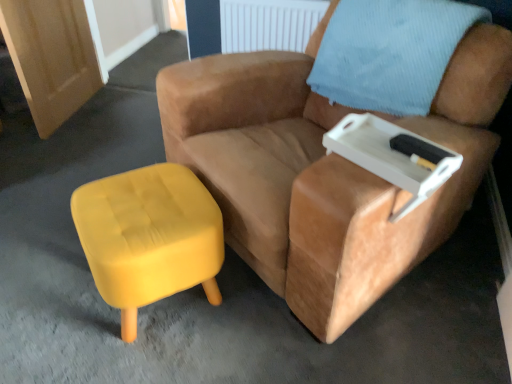
What is the approximate height of yellow fabric stool at lower left?

It is 16.01 inches.

You are a GUI agent. You are given a task and a screenshot of the screen. Output one action in this format:
    pyautogui.click(x=<x>, y=<y>)
    Task: Click on the light blue textured pillow at upper right
    Image resolution: width=512 pixels, height=384 pixels.
    Given the screenshot: What is the action you would take?
    pyautogui.click(x=390, y=52)

This screenshot has width=512, height=384. What are the coordinates of `yellow fabric stool at lower left` in the screenshot? It's located at (149, 237).

Between suede tan armchair at center and white plastic tray at upper right, which one has larger size?

suede tan armchair at center.

Is suede tan armchair at center to the right of white plastic tray at upper right from the viewer's perspective?

No.

In the scene shown: Are suede tan armchair at center and white plastic tray at upper right located far from each other?

Actually, suede tan armchair at center and white plastic tray at upper right are a little close together.

Considering the positions of points (276, 211) and (432, 163), is point (276, 211) farther from camera compared to point (432, 163)?

Yes, point (276, 211) is farther from viewer.

Is suede tan armchair at center closer to camera compared to light blue textured pillow at upper right?

Yes.

Is the surface of suede tan armchair at center in direct contact with light blue textured pillow at upper right?

suede tan armchair at center and light blue textured pillow at upper right are clearly separated.

Where is `pillow located above the suede tan armchair at center (from a real-world perspective)`? pillow located above the suede tan armchair at center (from a real-world perspective) is located at coordinates (390, 52).

Is suede tan armchair at center bigger or smaller than light blue textured pillow at upper right?

suede tan armchair at center is bigger than light blue textured pillow at upper right.

How many degrees apart are the facing directions of white plastic tray at upper right and suede tan armchair at center?

There is a 3.54-degree angle between the facing directions of white plastic tray at upper right and suede tan armchair at center.

Based on the photo, is white plastic tray at upper right taller or shorter than suede tan armchair at center?

Clearly, white plastic tray at upper right is shorter compared to suede tan armchair at center.

Is white plastic tray at upper right behind suede tan armchair at center?

Yes, white plastic tray at upper right is further from the viewer.

Is white plastic tray at upper right not close to suede tan armchair at center?

No, white plastic tray at upper right is in close proximity to suede tan armchair at center.

Find the location of a particular element. The width and height of the screenshot is (512, 384). stool beneath the white plastic tray at upper right (from a real-world perspective) is located at coordinates (149, 237).

Considering the relative sizes of yellow fabric stool at lower left and white plastic tray at upper right in the image provided, is yellow fabric stool at lower left taller than white plastic tray at upper right?

Indeed, yellow fabric stool at lower left has a greater height compared to white plastic tray at upper right.

Which is nearer, (x=398, y=34) or (x=310, y=72)?

Point (x=398, y=34).

From the image's perspective, is light blue textured pillow at upper right located above or below suede tan armchair at center?

Clearly, from the image's perspective, light blue textured pillow at upper right is above suede tan armchair at center.

Do you think light blue textured pillow at upper right is within suede tan armchair at center, or outside of it?

The correct answer is: inside.

Can you confirm if light blue textured pillow at upper right is thinner than yellow fabric stool at lower left?

In fact, light blue textured pillow at upper right might be wider than yellow fabric stool at lower left.

Can you confirm if light blue textured pillow at upper right is smaller than yellow fabric stool at lower left?

Actually, light blue textured pillow at upper right might be larger than yellow fabric stool at lower left.

Based on the photo, does light blue textured pillow at upper right touch yellow fabric stool at lower left?

No, light blue textured pillow at upper right is not making contact with yellow fabric stool at lower left.

Is yellow fabric stool at lower left located within light blue textured pillow at upper right?

No, yellow fabric stool at lower left is not inside light blue textured pillow at upper right.

Is light blue textured pillow at upper right not inside white plastic tray at upper right?

light blue textured pillow at upper right is positioned outside white plastic tray at upper right.

Considering the relative positions of light blue textured pillow at upper right and white plastic tray at upper right in the image provided, is light blue textured pillow at upper right to the left of white plastic tray at upper right from the viewer's perspective?

No, light blue textured pillow at upper right is not to the left of white plastic tray at upper right.

From a real-world perspective, which is physically above, light blue textured pillow at upper right or white plastic tray at upper right?

light blue textured pillow at upper right.

Where is `side table below the suede tan armchair at center (from the image's perspective)`? side table below the suede tan armchair at center (from the image's perspective) is located at coordinates (393, 156).

This screenshot has width=512, height=384. In the image, there is a light blue textured pillow at upper right. Find the location of `chair below it (from a real-world perspective)`. chair below it (from a real-world perspective) is located at coordinates [324, 171].

When comparing their distances from white plastic tray at upper right, does light blue textured pillow at upper right or yellow fabric stool at lower left seem closer?

Among the two, light blue textured pillow at upper right is located nearer to white plastic tray at upper right.

Consider the image. Looking at the image, which one is located closer to light blue textured pillow at upper right, suede tan armchair at center or yellow fabric stool at lower left?

The object closer to light blue textured pillow at upper right is suede tan armchair at center.

Looking at the image, which one is located further to yellow fabric stool at lower left, suede tan armchair at center or light blue textured pillow at upper right?

Among the two, light blue textured pillow at upper right is located further to yellow fabric stool at lower left.

Considering their positions, is white plastic tray at upper right positioned further to suede tan armchair at center than light blue textured pillow at upper right?

white plastic tray at upper right is further to suede tan armchair at center.

Which object lies further to the anchor point light blue textured pillow at upper right, suede tan armchair at center or white plastic tray at upper right?

The object further to light blue textured pillow at upper right is white plastic tray at upper right.

Which object lies further to the anchor point suede tan armchair at center, yellow fabric stool at lower left or light blue textured pillow at upper right?

yellow fabric stool at lower left.

Based on their spatial positions, is light blue textured pillow at upper right or white plastic tray at upper right closer to yellow fabric stool at lower left?

The object closer to yellow fabric stool at lower left is white plastic tray at upper right.

Looking at this image, looking at the image, which one is located further to light blue textured pillow at upper right, white plastic tray at upper right or yellow fabric stool at lower left?

yellow fabric stool at lower left.

The image size is (512, 384). Find the location of `chair between yellow fabric stool at lower left and white plastic tray at upper right in the horizontal direction`. chair between yellow fabric stool at lower left and white plastic tray at upper right in the horizontal direction is located at coordinates (324, 171).

Locate an element on the screen. The image size is (512, 384). side table situated between yellow fabric stool at lower left and light blue textured pillow at upper right from left to right is located at coordinates (393, 156).

Image resolution: width=512 pixels, height=384 pixels. Identify the location of chair between light blue textured pillow at upper right and white plastic tray at upper right vertically. (324, 171).

Find the location of `chair between yellow fabric stool at lower left and light blue textured pillow at upper right from left to right`. chair between yellow fabric stool at lower left and light blue textured pillow at upper right from left to right is located at coordinates coord(324,171).